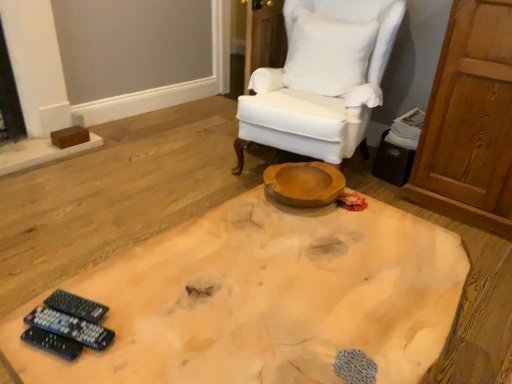
Where is `free spot above natural wood coffee table at center (from a real-world perspective)`? The width and height of the screenshot is (512, 384). free spot above natural wood coffee table at center (from a real-world perspective) is located at coordinates (279, 273).